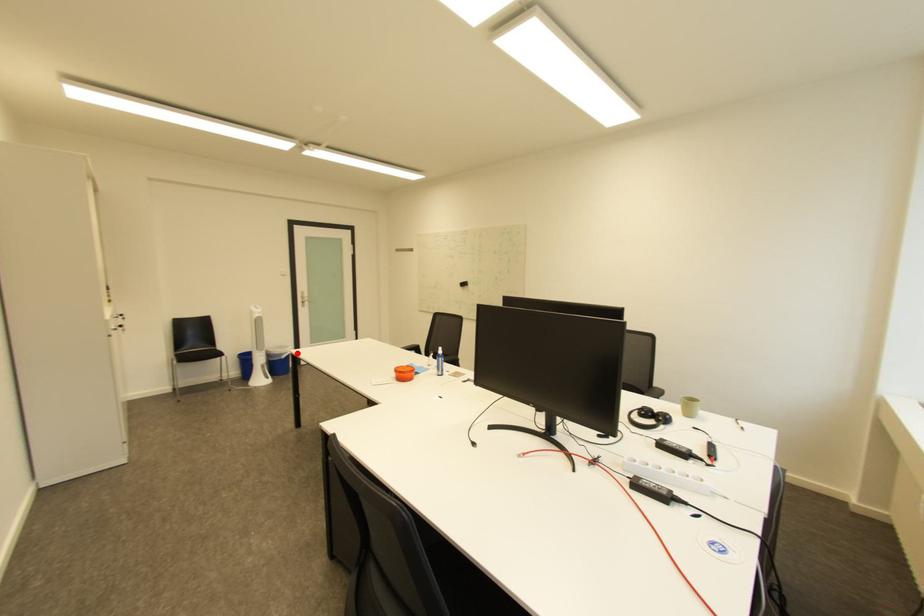
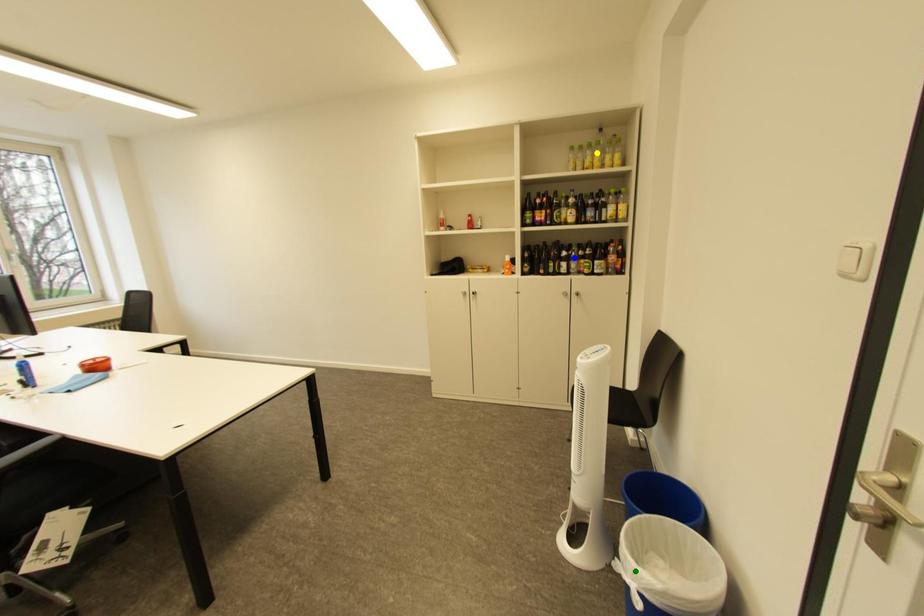
Question: I am providing you with two images of the same scene from different viewpoints. A red point is marked on the first image. You are given multiple points on the second image. Can you choose the point in image 2 that corresponds to the point in image 1?

Choices:
 (A) blue point
 (B) green point
 (C) yellow point

Answer: (B)